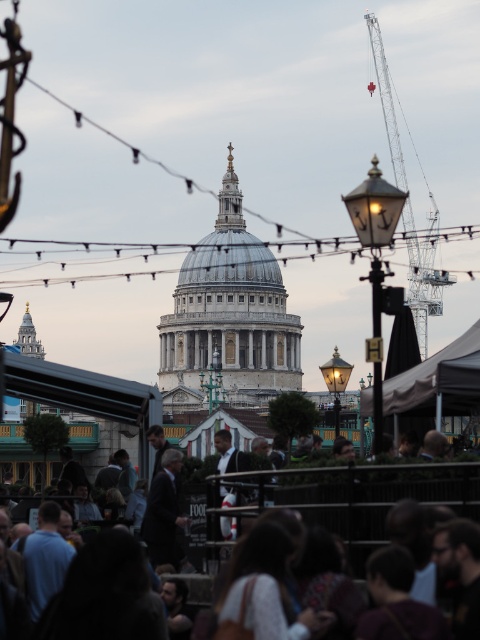
Who is positioned more to the right, dark brown hair at lower center or metallic gray crane at upper right?

metallic gray crane at upper right is more to the right.

Which is behind, point (358, 474) or point (433, 280)?

The point (433, 280) is behind.

Locate an element on the screen. dark brown hair at lower center is located at coordinates (360, 493).

Who is lower down, metallic gray crane at upper right or dark suit at center?

dark suit at center is lower down.

Based on the photo, who is shorter, metallic gray crane at upper right or dark suit at center?

dark suit at center is shorter.

Does point (408, 224) come in front of point (164, 552)?

No.

Find the location of a particular element. The image size is (480, 640). metallic gray crane at upper right is located at coordinates (423, 273).

What do you see at coordinates (360, 493) in the screenshot? The height and width of the screenshot is (640, 480). I see `dark brown hair at lower center` at bounding box center [360, 493].

Is dark brown hair at lower center bigger than dark suit at center?

Yes, dark brown hair at lower center is bigger than dark suit at center.

Who is more distant from viewer, (465, 493) or (167, 516)?

The point (167, 516) is more distant.

Find the location of a particular element. The width and height of the screenshot is (480, 640). dark brown hair at lower center is located at coordinates (360, 493).